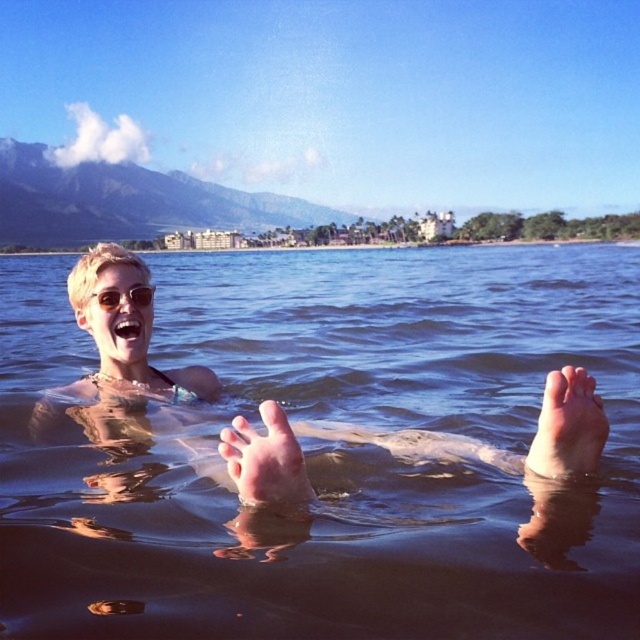
Question: Which point is farther to the camera?

Choices:
 (A) clear water at feet center
 (B) shiny silver sunglasses at upper center
 (C) pink flesh at lower right
 (D) pink flesh at center

Answer: (B)

Question: Estimate the real-world distances between objects in this image. Which object is closer to the shiny silver sunglasses at upper center?

Choices:
 (A) pink flesh at lower right
 (B) pink flesh at center
 (C) clear water at feet center

Answer: (B)

Question: Which point is farther to the camera?

Choices:
 (A) (582, 381)
 (B) (248, 492)
 (C) (618, 566)

Answer: (A)

Question: From the image, what is the correct spatial relationship of clear water at feet center in relation to shiny silver sunglasses at upper center?

Choices:
 (A) below
 (B) above

Answer: (B)

Question: Is clear water at feet center closer to camera compared to pink flesh at lower right?

Choices:
 (A) no
 (B) yes

Answer: (B)

Question: From the image, what is the correct spatial relationship of clear water at feet center in relation to shiny silver sunglasses at upper center?

Choices:
 (A) above
 (B) below

Answer: (A)